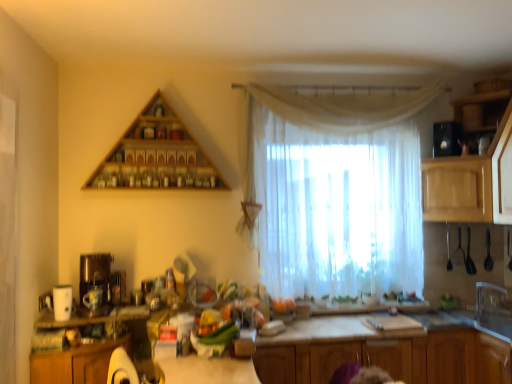
Question: Considering the relative sizes of clear plastic faucet at right and wooden cabinet at lower left, the first cabinetry from the left, in the image provided, is clear plastic faucet at right wider than wooden cabinet at lower left, the first cabinetry from the left,?

Choices:
 (A) yes
 (B) no

Answer: (B)

Question: Is clear plastic faucet at right facing towards wooden cabinet at lower left, the fifth cabinetry from the right?

Choices:
 (A) no
 (B) yes

Answer: (B)

Question: Does clear plastic faucet at right appear on the left side of wooden cabinet at lower left, the first cabinetry from the left?

Choices:
 (A) yes
 (B) no

Answer: (B)

Question: From the image's perspective, does clear plastic faucet at right appear higher than wooden cabinet at lower left, the first cabinetry from the left?

Choices:
 (A) yes
 (B) no

Answer: (A)

Question: Is clear plastic faucet at right turned away from wooden cabinet at lower left, the fifth cabinetry from the right?

Choices:
 (A) no
 (B) yes

Answer: (A)

Question: Is wooden cabinet at lower left, the fifth cabinetry from the right, completely or partially inside clear plastic faucet at right?

Choices:
 (A) no
 (B) yes

Answer: (A)

Question: Is black glossy microwave at upper right, which appears as the third appliance when viewed from the left, not near wooden cabinet at lower right, placed as the 4th cabinetry when sorted from left to right?

Choices:
 (A) yes
 (B) no

Answer: (A)

Question: Can you confirm if black glossy microwave at upper right, the third appliance viewed from the front, is wider than wooden cabinet at lower right, placed as the second cabinetry when sorted from right to left?

Choices:
 (A) yes
 (B) no

Answer: (B)

Question: Is black glossy microwave at upper right, the third appliance viewed from the front, at the left side of wooden cabinet at lower right, placed as the 4th cabinetry when sorted from left to right?

Choices:
 (A) no
 (B) yes

Answer: (B)

Question: Is black glossy microwave at upper right, acting as the 1th appliance starting from the right, located outside wooden cabinet at lower right, placed as the 4th cabinetry when sorted from left to right?

Choices:
 (A) no
 (B) yes

Answer: (B)

Question: Is black glossy microwave at upper right, which ranks as the third appliance in bottom-to-top order, thinner than wooden cabinet at lower right, placed as the 4th cabinetry when sorted from left to right?

Choices:
 (A) yes
 (B) no

Answer: (A)

Question: Is black glossy microwave at upper right, the third appliance viewed from the front, placed right next to wooden cabinet at lower right, placed as the 4th cabinetry when sorted from left to right?

Choices:
 (A) no
 (B) yes

Answer: (A)

Question: Is matte brown coffee machine at left aimed at wooden cabinets at center, arranged as the 4th cabinetry when viewed from the right?

Choices:
 (A) no
 (B) yes

Answer: (A)